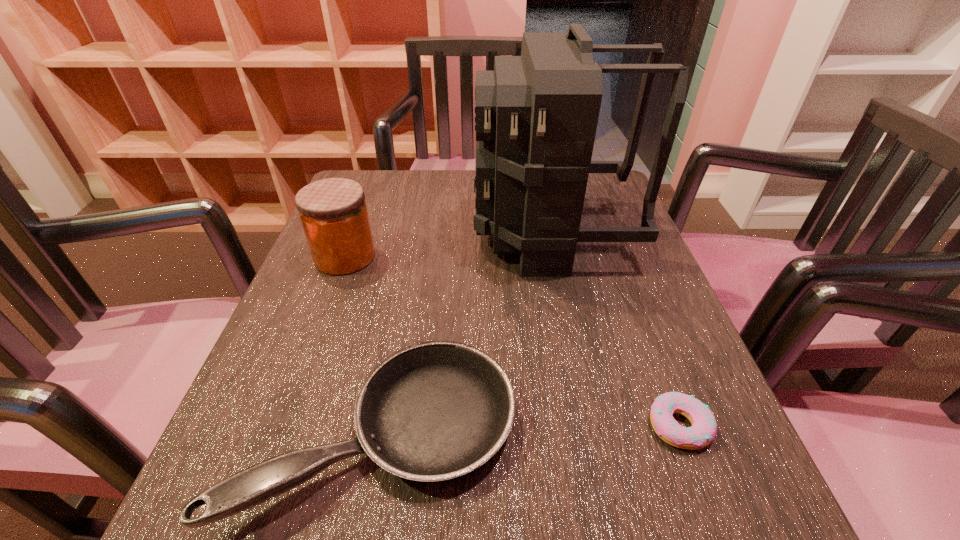
This screenshot has width=960, height=540. I want to click on the tallest object, so click(x=536, y=115).

The image size is (960, 540). I want to click on jar, so click(333, 212).

You are a GUI agent. You are given a task and a screenshot of the screen. Output one action in this format:
    pyautogui.click(x=<x>, y=<y>)
    Task: Click on the shortest object
    This screenshot has height=540, width=960.
    Given the screenshot: What is the action you would take?
    pos(702,432)

This screenshot has width=960, height=540. Find the location of `vacant space located 0.140m on the front compartment of the tallest object`. vacant space located 0.140m on the front compartment of the tallest object is located at coordinates (414, 235).

Locate an element on the screen. This screenshot has width=960, height=540. free spot located on the front compartment of the tallest object is located at coordinates (366, 235).

At what (x,y) coordinates should I click in order to perform the action: click on blank area located 0.270m on the front compartment of the tallest object. Please return your answer as a coordinate pair (x, y). The width and height of the screenshot is (960, 540). Looking at the image, I should click on (357, 235).

The width and height of the screenshot is (960, 540). What are the coordinates of `vacant space located on the right of the second tallest object` in the screenshot? It's located at pos(463,256).

The width and height of the screenshot is (960, 540). I want to click on vacant space located on the left of the shortest object, so click(x=555, y=426).

Find the location of `object that is at the far edge`. object that is at the far edge is located at coordinates pyautogui.click(x=536, y=115).

In order to click on object at the left edge in this screenshot , I will do `click(333, 212)`.